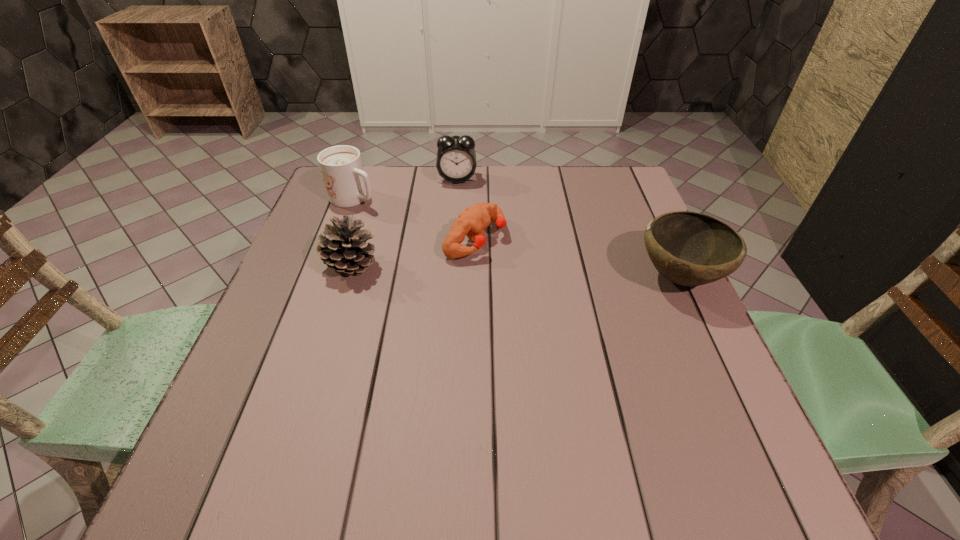
This screenshot has width=960, height=540. Identify the location of free region located with the gloves of the puncher facing forward. (555, 278).

The image size is (960, 540). Find the location of `vacant position located with the gloves of the puncher facing forward`. vacant position located with the gloves of the puncher facing forward is located at coordinates (634, 315).

Locate an element on the screen. This screenshot has width=960, height=540. vacant space located with the gloves of the puncher facing forward is located at coordinates (660, 328).

Identify the location of vacant space located on the side with the handle of the cappuccino. This screenshot has height=540, width=960. (410, 226).

Locate an element on the screen. The height and width of the screenshot is (540, 960). free space located 0.300m on the side with the handle of the cappuccino is located at coordinates (453, 249).

Locate an element on the screen. The height and width of the screenshot is (540, 960). free space located 0.180m on the side with the handle of the cappuccino is located at coordinates (418, 231).

Where is `alarm clock present at the far edge`? The image size is (960, 540). alarm clock present at the far edge is located at coordinates (456, 162).

Locate an element on the screen. The width and height of the screenshot is (960, 540). cappuccino that is at the far edge is located at coordinates (347, 184).

This screenshot has width=960, height=540. What are the coordinates of `pinecone positioned at the left edge` in the screenshot? It's located at (343, 248).

The width and height of the screenshot is (960, 540). In order to click on cappuccino that is at the left edge in this screenshot , I will do `click(347, 184)`.